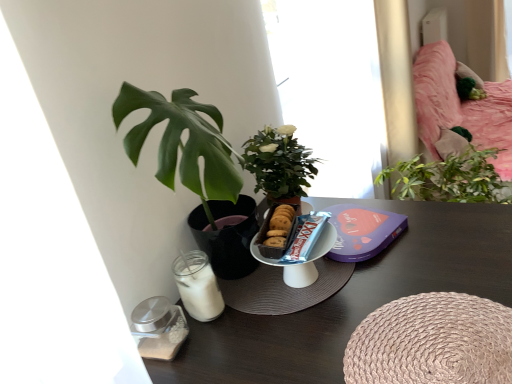
Locate an element on the screen. free point above wooden table at lower left (from a real-world perspective) is located at coordinates (359, 297).